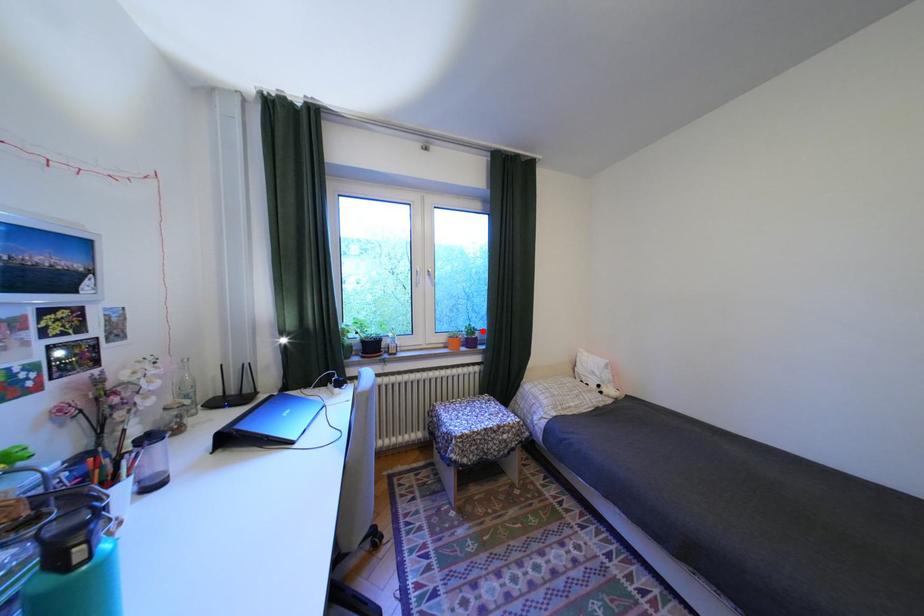
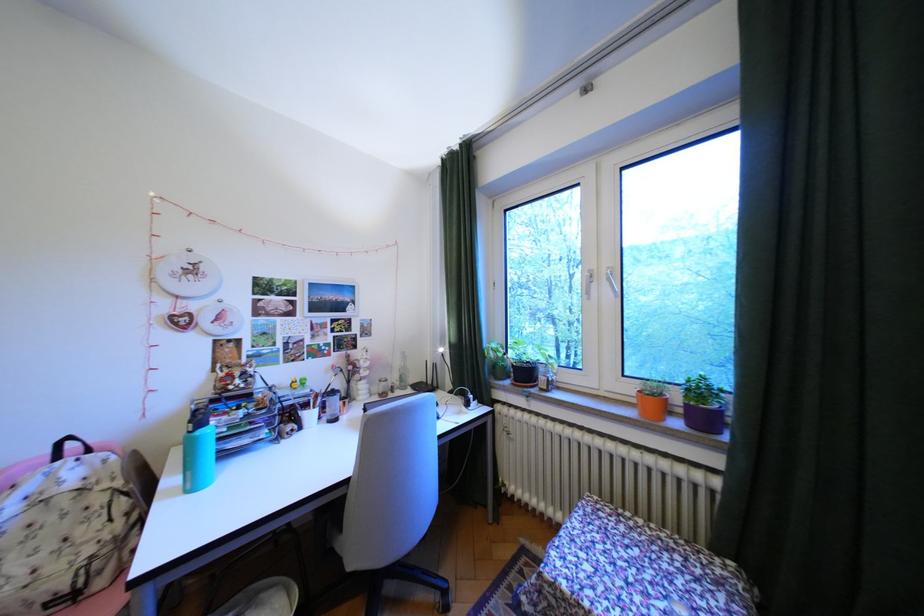
Find the pixel in the second image that matches the highlighted location in the first image.

(710, 391)